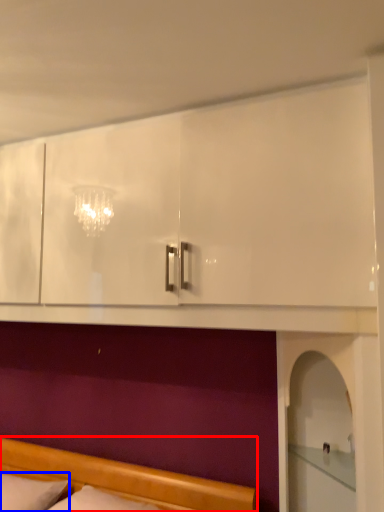
Question: Which object is further to the camera taking this photo, bed (highlighted by a red box) or pillow (highlighted by a blue box)?

Choices:
 (A) bed
 (B) pillow

Answer: (B)